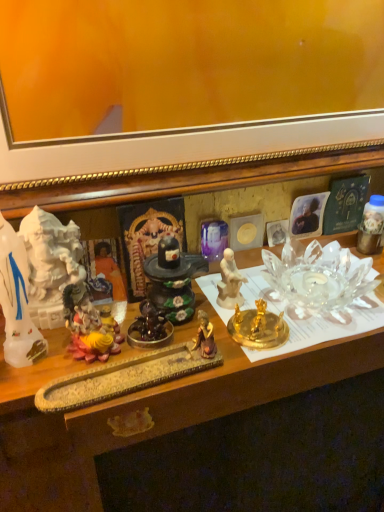
Where is `empty space that is ontop of gold metallic tray at center (from a real-world perspective)`? empty space that is ontop of gold metallic tray at center (from a real-world perspective) is located at coordinates (234, 316).